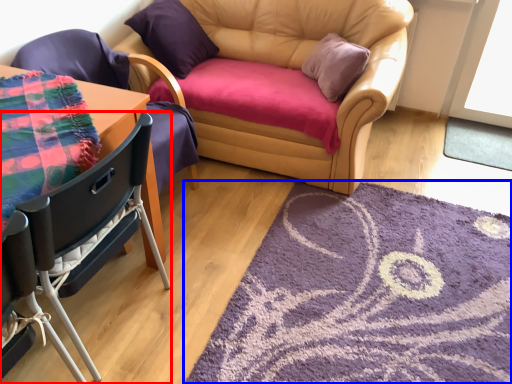
Question: Which of the following is the farthest to the observer, chair (highlighted by a red box) or mat (highlighted by a blue box)?

Choices:
 (A) chair
 (B) mat

Answer: (B)